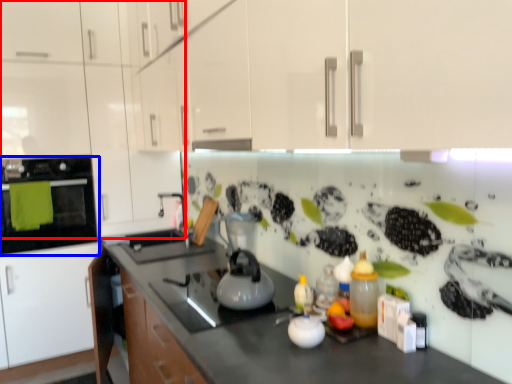
Question: Which object appears farthest to the camera in this image, cabinetry (highlighted by a red box) or home appliance (highlighted by a blue box)?

Choices:
 (A) cabinetry
 (B) home appliance

Answer: (B)